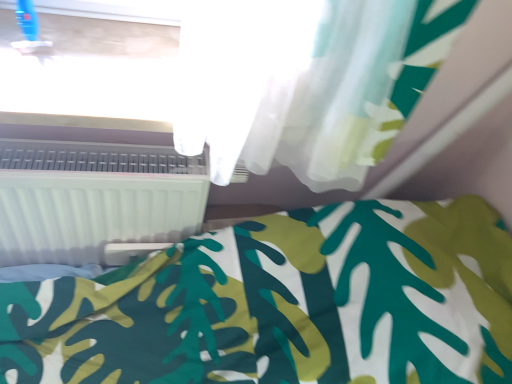
Question: Considering the positions of white plastic window frame at upper center and white plastic radiator at lower left in the image, is white plastic window frame at upper center bigger or smaller than white plastic radiator at lower left?

Choices:
 (A) big
 (B) small

Answer: (B)

Question: In the image, is white plastic window frame at upper center positioned in front of or behind white plastic radiator at lower left?

Choices:
 (A) behind
 (B) front

Answer: (B)

Question: Which is nearer to the white fabric bed at lower right?

Choices:
 (A) white plastic radiator at lower left
 (B) white plastic window frame at upper center

Answer: (A)

Question: Which object is the closest to the white plastic window frame at upper center?

Choices:
 (A) white fabric bed at lower right
 (B) white plastic radiator at lower left

Answer: (B)